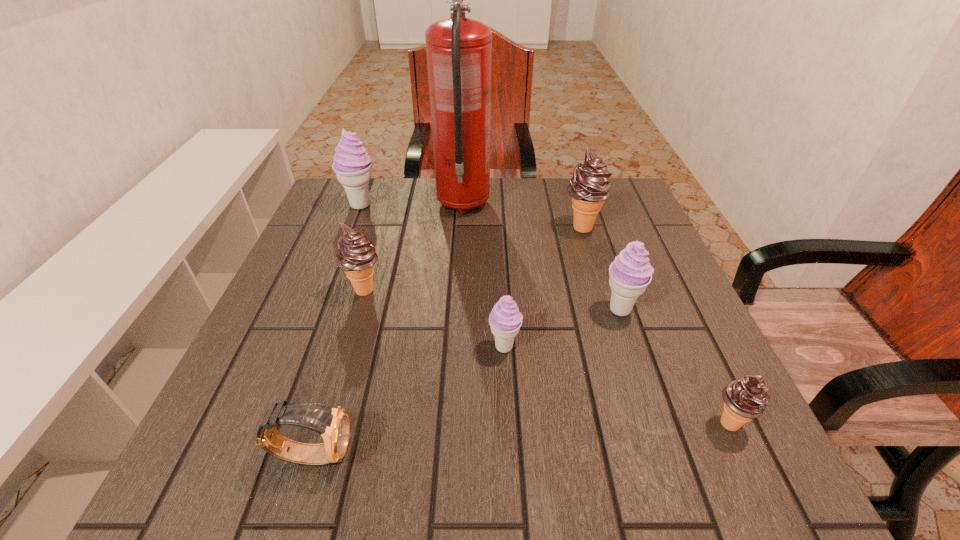
I want to click on the second closest purple icecream to the second chocolate icecream from left to right, so click(x=505, y=320).

At what (x,y) coordinates should I click in order to perform the action: click on vacant space that satisfies the following two spatial constraints: 1. on the front side of the second purple icecream from left to right; 2. on the face of the watch. Please return your answer as a coordinate pair (x, y). Looking at the image, I should click on (510, 454).